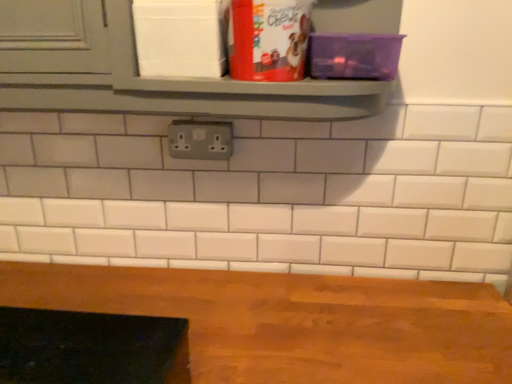
Question: Is gray plastic outlet at center positioned beyond the bounds of wooden table at bottom?

Choices:
 (A) no
 (B) yes

Answer: (B)

Question: From a real-world perspective, is gray plastic outlet at center positioned under wooden table at bottom based on gravity?

Choices:
 (A) no
 (B) yes

Answer: (A)

Question: Is gray plastic outlet at center looking in the opposite direction of wooden table at bottom?

Choices:
 (A) no
 (B) yes

Answer: (A)

Question: From the image's perspective, is gray plastic outlet at center above wooden table at bottom?

Choices:
 (A) no
 (B) yes

Answer: (B)

Question: Is gray plastic outlet at center positioned in front of wooden table at bottom?

Choices:
 (A) no
 (B) yes

Answer: (A)

Question: Is gray plastic outlet at center bigger than wooden table at bottom?

Choices:
 (A) yes
 (B) no

Answer: (B)

Question: Can you confirm if wooden table at bottom is thinner than gray plastic outlet at center?

Choices:
 (A) yes
 (B) no

Answer: (B)

Question: Considering the relative positions of wooden table at bottom and gray plastic outlet at center in the image provided, is wooden table at bottom to the right of gray plastic outlet at center from the viewer's perspective?

Choices:
 (A) yes
 (B) no

Answer: (A)

Question: Considering the relative sizes of wooden table at bottom and gray plastic outlet at center in the image provided, is wooden table at bottom taller than gray plastic outlet at center?

Choices:
 (A) no
 (B) yes

Answer: (A)

Question: Is the surface of wooden table at bottom in direct contact with gray plastic outlet at center?

Choices:
 (A) no
 (B) yes

Answer: (A)

Question: Does wooden table at bottom have a smaller size compared to gray plastic outlet at center?

Choices:
 (A) no
 (B) yes

Answer: (A)

Question: Can you confirm if wooden table at bottom is wider than gray plastic outlet at center?

Choices:
 (A) yes
 (B) no

Answer: (A)

Question: Considering the positions of wooden table at bottom and gray plastic outlet at center in the image, is wooden table at bottom wider or thinner than gray plastic outlet at center?

Choices:
 (A) wide
 (B) thin

Answer: (A)